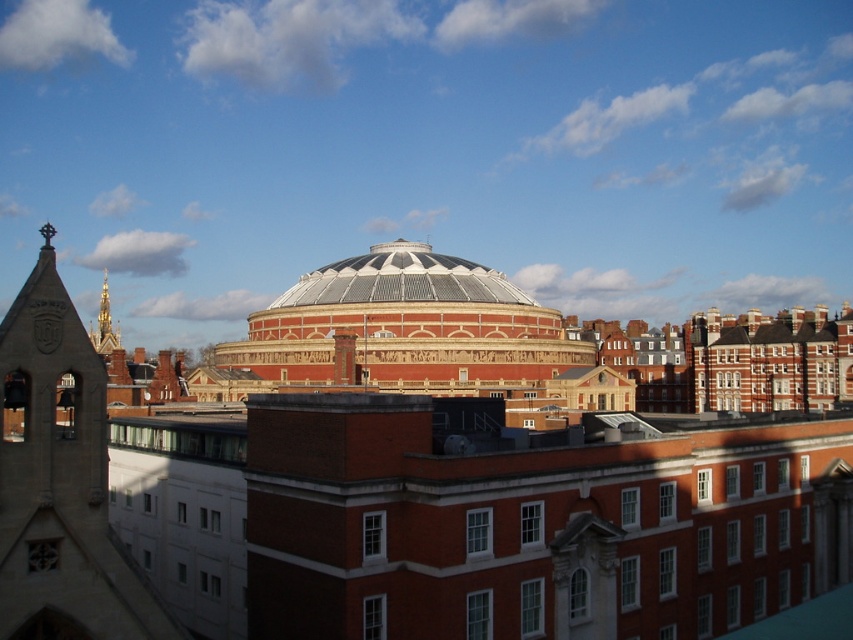
You are standing at the center of the city square in front of the Royal Albert Hall. You want to take a photo of the stone bell tower at left. In which direction should you point your camera?

The stone bell tower at left is located at coordinates 0.753 on the x axis and 0.072 on the y axis, so you should point your camera to the left side of the frame to capture it.